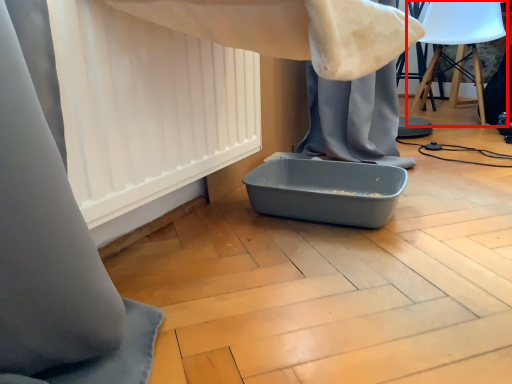
Question: From the image's perspective, what is the correct spatial relationship of swivel chair (annotated by the red box) in relation to curtain?

Choices:
 (A) below
 (B) above

Answer: (B)